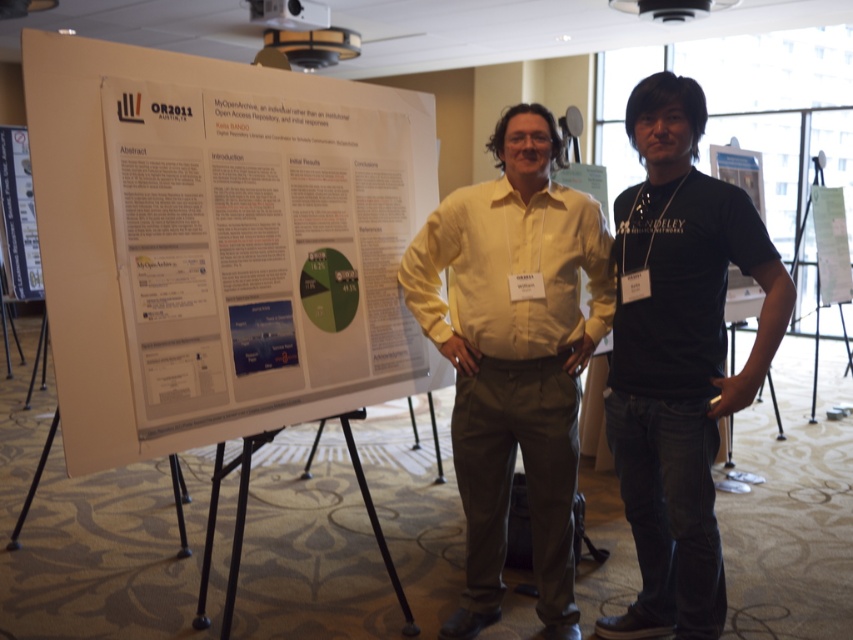
Question: Does white paperboard at center have a lesser width compared to white paper at center?

Choices:
 (A) yes
 (B) no

Answer: (B)

Question: Observing the image, what is the correct spatial positioning of white paperboard at center in reference to metallic silver poster at left?

Choices:
 (A) right
 (B) left

Answer: (A)

Question: Does metallic silver poster at left appear on the left side of white paper at center?

Choices:
 (A) yes
 (B) no

Answer: (A)

Question: Which point is closer to the camera?

Choices:
 (A) white paper at center
 (B) metallic silver poster at left
 (C) yellow matte shirt at center
 (D) white paperboard at center

Answer: (D)

Question: Which point is farther to the camera?

Choices:
 (A) (753, 243)
 (B) (822, 276)
 (C) (15, 180)

Answer: (C)

Question: Which object is closer to the camera taking this photo?

Choices:
 (A) yellow matte shirt at center
 (B) white paperboard at center

Answer: (B)